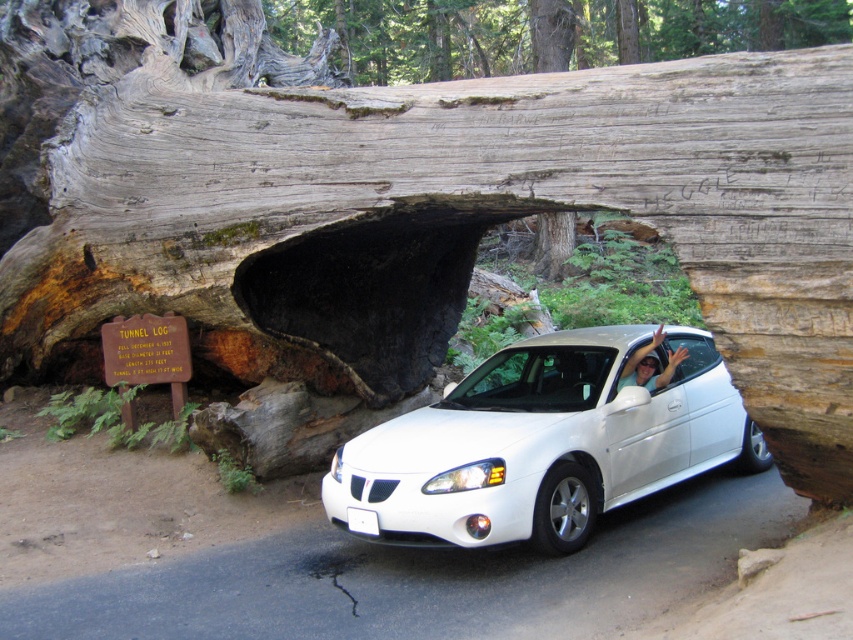
Image resolution: width=853 pixels, height=640 pixels. Identify the location of white glossy hatchback at center. (543, 444).

Which is more to the right, white glossy hatchback at center or white glossy car at center?

white glossy car at center is more to the right.

Measure the distance between point (527, 444) and camera.

The distance of point (527, 444) from camera is 6.01 meters.

Where is `white glossy hatchback at center`? The image size is (853, 640). white glossy hatchback at center is located at coordinates (543, 444).